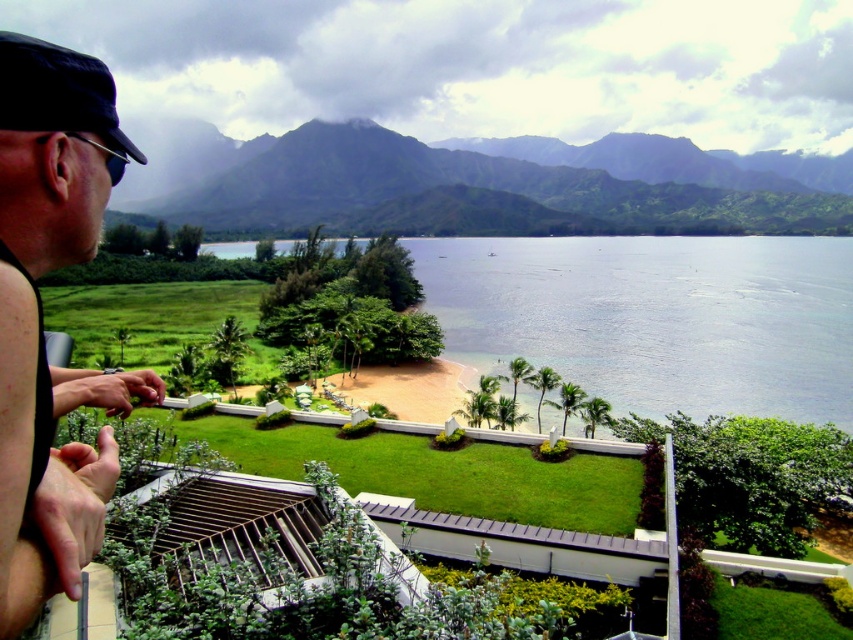
Looking at this image, does green textured mountains at upper center appear on the left side of sunglasses at left?

In fact, green textured mountains at upper center is to the right of sunglasses at left.

Is point (425, 161) positioned in front of point (91, 483)?

No, it is behind (91, 483).

Measure the distance between green textured mountains at upper center and camera.

The distance of green textured mountains at upper center from camera is 283.48 meters.

Where is `green textured mountains at upper center`? The image size is (853, 640). green textured mountains at upper center is located at coordinates (473, 193).

Is sunglasses at left below dark blue fabric baseball cap at left?

Correct, sunglasses at left is located below dark blue fabric baseball cap at left.

Locate an element on the screen. Image resolution: width=853 pixels, height=640 pixels. sunglasses at left is located at coordinates (39, 307).

This screenshot has width=853, height=640. I want to click on sunglasses at left, so click(x=39, y=307).

Between green textured mountains at upper center and dark blue fabric baseball cap at left, which one is positioned higher?

green textured mountains at upper center is above.

Who is taller, green textured mountains at upper center or dark blue fabric baseball cap at left?

Standing taller between the two is green textured mountains at upper center.

Is point (659, 154) closer to camera compared to point (94, 115)?

That is False.

I want to click on green textured mountains at upper center, so click(x=473, y=193).